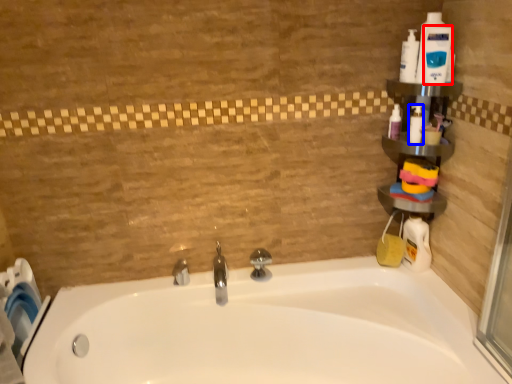
Question: Among these objects, which one is farthest to the camera, cleaning product (highlighted by a red box) or cleaning product (highlighted by a blue box)?

Choices:
 (A) cleaning product
 (B) cleaning product

Answer: (B)